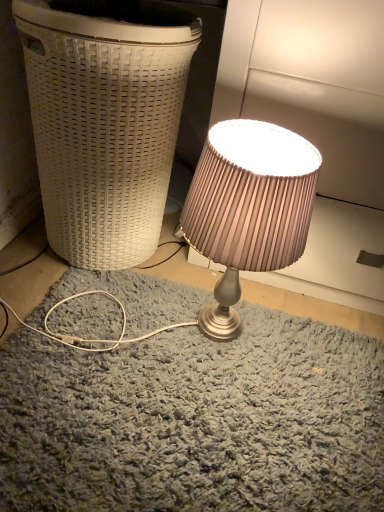
Question: Is white woven basket at left inside the boundaries of satin pink lampshade at center, or outside?

Choices:
 (A) outside
 (B) inside

Answer: (A)

Question: Is point (94, 151) positioned closer to the camera than point (309, 176)?

Choices:
 (A) farther
 (B) closer

Answer: (A)

Question: From the image's perspective, relative to satin pink lampshade at center, is white woven basket at left above or below?

Choices:
 (A) below
 (B) above

Answer: (B)

Question: Is point (208, 309) positioned closer to the camera than point (168, 94)?

Choices:
 (A) farther
 (B) closer

Answer: (A)

Question: Is satin pink lampshade at center inside or outside of white woven basket at left?

Choices:
 (A) inside
 (B) outside

Answer: (B)

Question: From the image's perspective, is satin pink lampshade at center located above or below white woven basket at left?

Choices:
 (A) below
 (B) above

Answer: (A)

Question: In the image, is satin pink lampshade at center positioned in front of or behind white woven basket at left?

Choices:
 (A) behind
 (B) front

Answer: (B)